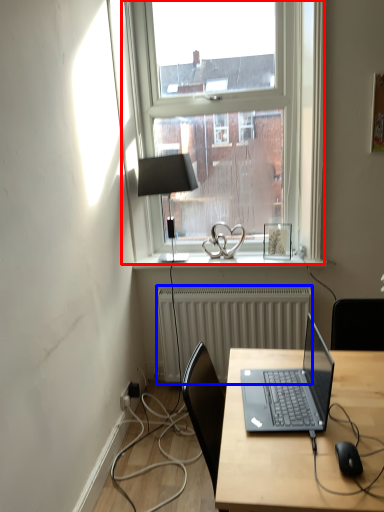
Question: Which object appears farthest to the camera in this image, window (highlighted by a red box) or radiator (highlighted by a blue box)?

Choices:
 (A) window
 (B) radiator

Answer: (B)